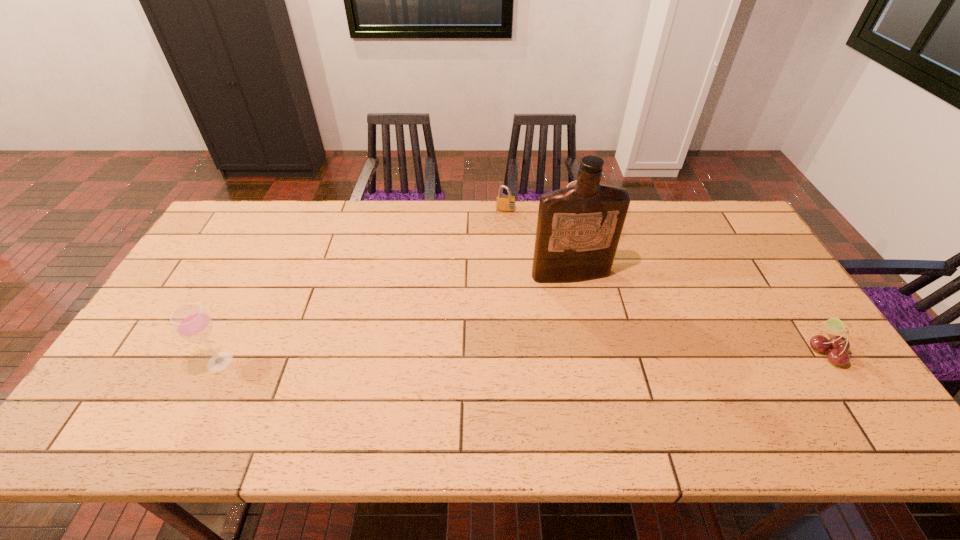
You are a GUI agent. You are given a task and a screenshot of the screen. Output one action in this format:
    pyautogui.click(x=<x>, y=<y>)
    Task: Click on the vacant spot on the desktop that is between the wineglass and the rightmost object and is positioned on the side with the combination dials of the padlock
    
    Given the screenshot: What is the action you would take?
    pyautogui.click(x=498, y=357)

This screenshot has width=960, height=540. I want to click on free space on the desktop that is between the wineglass and the cherry and is positioned on the label side of the third nearest object, so click(x=601, y=355).

Image resolution: width=960 pixels, height=540 pixels. I want to click on vacant space on the desktop that is between the fourth shortest object and the rightmost object and is positioned on the side of the mug with the handle, so click(x=606, y=355).